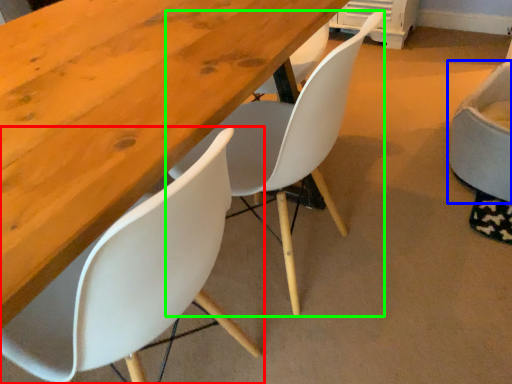
Question: Which object is the farthest from chair (highlighted by a red box)? Choose among these: chair (highlighted by a blue box) or chair (highlighted by a green box).

Choices:
 (A) chair
 (B) chair

Answer: (A)